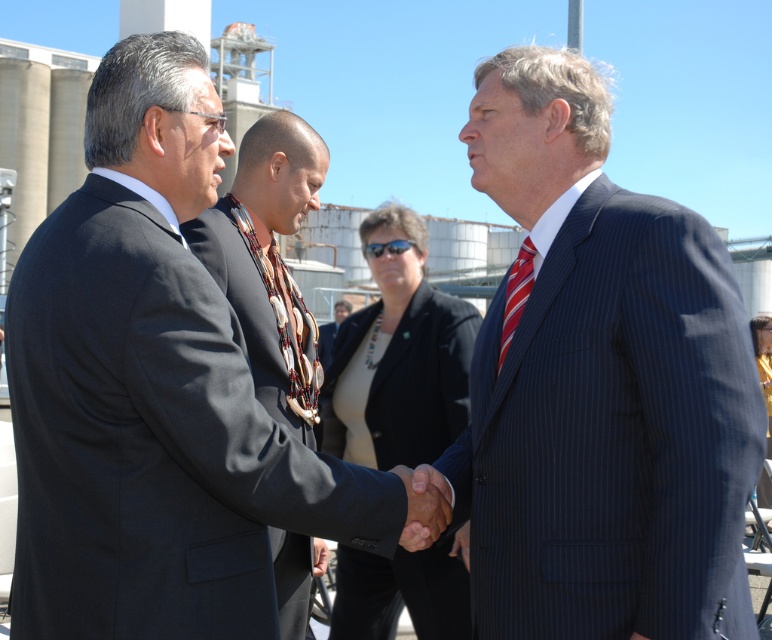
Who is positioned more to the right, pinstriped suit at center or dark gray suit at center?

pinstriped suit at center

This screenshot has height=640, width=772. What do you see at coordinates (598, 385) in the screenshot?
I see `pinstriped suit at center` at bounding box center [598, 385].

This screenshot has width=772, height=640. Identify the location of pinstriped suit at center. (598, 385).

I want to click on pinstriped suit at center, so click(x=598, y=385).

Who is more forward, (36,566) or (364,570)?

Positioned in front is point (36,566).

Does matte black suit at center have a greater width compared to matte black blazer at center?

Indeed, matte black suit at center has a greater width compared to matte black blazer at center.

What are the coordinates of `matte black suit at center` in the screenshot? It's located at (157, 394).

Between matte black blazer at center and dark gray suit at center, which one appears on the left side from the viewer's perspective?

dark gray suit at center is more to the left.

Who is lower down, matte black blazer at center or dark gray suit at center?

matte black blazer at center is lower down.

The width and height of the screenshot is (772, 640). Identify the location of matte black blazer at center. (398, 355).